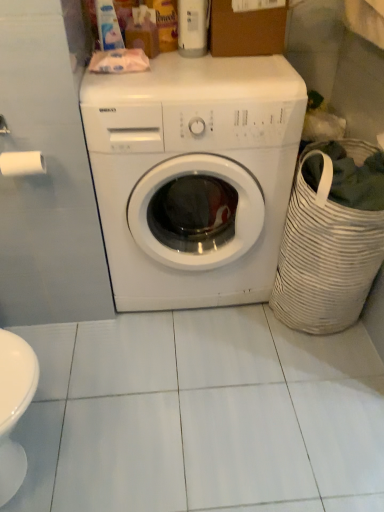
Question: Does white woven laundry basket at right contain brown cardboard box at upper center?

Choices:
 (A) no
 (B) yes

Answer: (A)

Question: From a real-world perspective, is white woven laundry basket at right under brown cardboard box at upper center?

Choices:
 (A) no
 (B) yes

Answer: (B)

Question: Is the surface of white woven laundry basket at right in direct contact with brown cardboard box at upper center?

Choices:
 (A) no
 (B) yes

Answer: (A)

Question: Does white woven laundry basket at right have a greater width compared to brown cardboard box at upper center?

Choices:
 (A) yes
 (B) no

Answer: (A)

Question: Can you confirm if white woven laundry basket at right is positioned to the left of brown cardboard box at upper center?

Choices:
 (A) no
 (B) yes

Answer: (A)

Question: From the image's perspective, is white glossy washing machine at center above or below white woven laundry basket at right?

Choices:
 (A) above
 (B) below

Answer: (A)

Question: From a real-world perspective, relative to white woven laundry basket at right, is white glossy washing machine at center vertically above or below?

Choices:
 (A) above
 (B) below

Answer: (A)

Question: Does point (137, 147) appear closer or farther from the camera than point (332, 304)?

Choices:
 (A) closer
 (B) farther

Answer: (A)

Question: Relative to white woven laundry basket at right, is white glossy washing machine at center in front or behind?

Choices:
 (A) behind
 (B) front

Answer: (B)

Question: Choose the correct answer: Is white glossy washing machine at center inside brown cardboard box at upper center or outside it?

Choices:
 (A) inside
 (B) outside

Answer: (B)

Question: From a real-world perspective, is white glossy washing machine at center positioned above or below brown cardboard box at upper center?

Choices:
 (A) above
 (B) below

Answer: (B)

Question: From the image's perspective, relative to brown cardboard box at upper center, is white glossy washing machine at center above or below?

Choices:
 (A) below
 (B) above

Answer: (A)

Question: In terms of width, does white glossy washing machine at center look wider or thinner when compared to brown cardboard box at upper center?

Choices:
 (A) thin
 (B) wide

Answer: (B)

Question: From a real-world perspective, is white woven laundry basket at right physically located above or below white glossy washing machine at center?

Choices:
 (A) below
 (B) above

Answer: (A)

Question: Based on their positions, is white woven laundry basket at right located to the left or right of white glossy washing machine at center?

Choices:
 (A) right
 (B) left

Answer: (A)